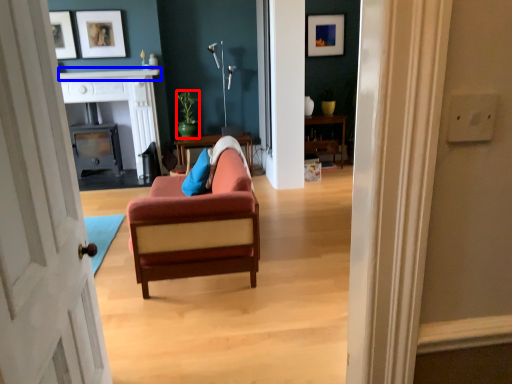
Question: Which object is closer to the camera taking this photo, houseplant (highlighted by a red box) or mantle (highlighted by a blue box)?

Choices:
 (A) houseplant
 (B) mantle

Answer: (B)